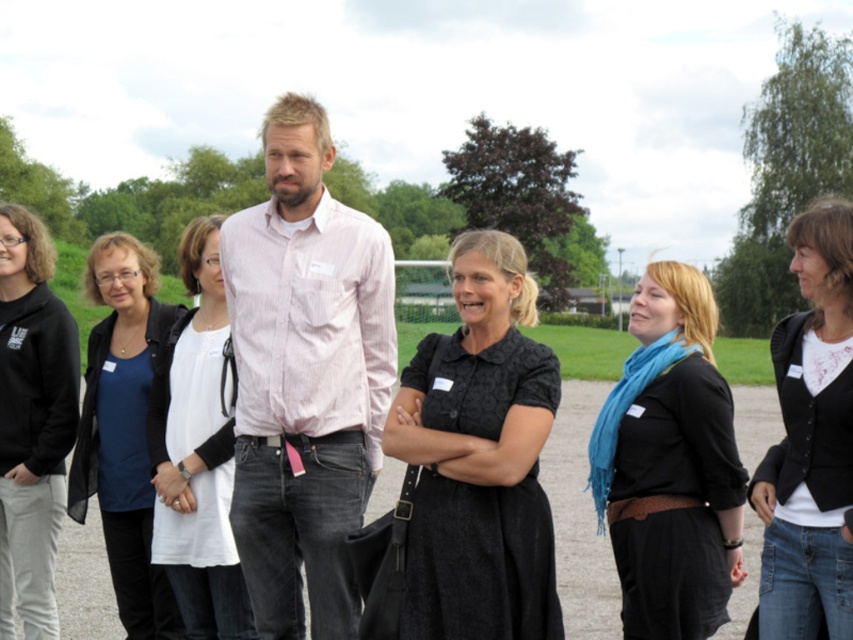
Can you confirm if pink striped shirt at center is bigger than white cotton dress at center?

Correct, pink striped shirt at center is larger in size than white cotton dress at center.

In the scene shown: Does pink striped shirt at center have a lesser width compared to white cotton dress at center?

No, pink striped shirt at center is not thinner than white cotton dress at center.

Does point (376, 432) lie in front of point (171, 413)?

Yes.

This screenshot has width=853, height=640. Identify the location of pink striped shirt at center. (305, 376).

Can you confirm if pink striped shirt at center is bigger than matte black shirt at center?

No, pink striped shirt at center is not bigger than matte black shirt at center.

Is point (251, 243) less distant than point (120, 525)?

That is True.

Who is more forward, (361, 403) or (161, 602)?

Positioned in front is point (361, 403).

The image size is (853, 640). What are the coordinates of `pink striped shirt at center` in the screenshot? It's located at (305, 376).

Which is in front, point (548, 429) or point (666, 531)?

Point (548, 429)

Between black textured dress at center and black matte scarf at center, which one has more height?

With more height is black matte scarf at center.

Is point (523, 422) behind point (643, 544)?

No.

Locate an element on the screen. The width and height of the screenshot is (853, 640). black textured dress at center is located at coordinates (479, 458).